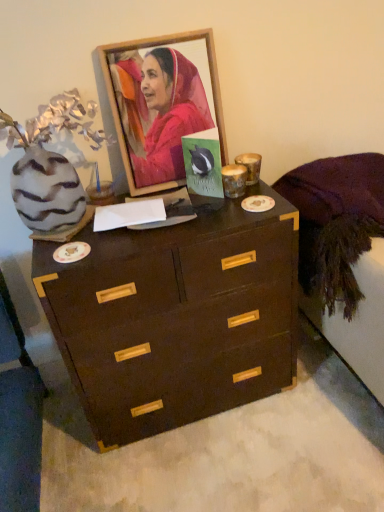
I want to click on purple fabric at right, so [x=343, y=255].

The height and width of the screenshot is (512, 384). Find the location of `green matte postcard at center`. green matte postcard at center is located at coordinates (203, 163).

Looking at this image, is wooden picture frame at upper center behind dark wood chest of drawers at center?

Yes, the depth of wooden picture frame at upper center is greater than that of dark wood chest of drawers at center.

From a real-world perspective, which object stands above the other?

From a 3D spatial view, wooden picture frame at upper center is above.

Is wooden picture frame at upper center positioned with its back to dark wood chest of drawers at center?

wooden picture frame at upper center is not turned away from dark wood chest of drawers at center.

Based on the photo, between wooden picture frame at upper center and dark wood chest of drawers at center, which one has larger size?

With larger size is dark wood chest of drawers at center.

Can you confirm if dark wood chest of drawers at center is positioned to the left of wooden picture frame at upper center?

Incorrect, dark wood chest of drawers at center is not on the left side of wooden picture frame at upper center.

Is wooden picture frame at upper center at the back of dark wood chest of drawers at center?

No.

From a real-world perspective, is dark wood chest of drawers at center physically located above or below wooden picture frame at upper center?

dark wood chest of drawers at center is below wooden picture frame at upper center.

You are a GUI agent. You are given a task and a screenshot of the screen. Output one action in this format:
    pyautogui.click(x=<x>, y=<y>)
    Task: Click on the picture frame on the left of the dark wood chest of drawers at center
    
    Given the screenshot: What is the action you would take?
    pyautogui.click(x=160, y=105)

Is purple fabric at right at the back of green matte postcard at center?

No, green matte postcard at center's orientation is not away from purple fabric at right.

Considering the positions of objects green matte postcard at center and purple fabric at right in the image provided, who is behind, green matte postcard at center or purple fabric at right?

green matte postcard at center is further from the camera.

Does point (212, 170) lie in front of point (371, 169)?

That is True.

You are a GUI agent. You are given a task and a screenshot of the screen. Output one action in this format:
    pyautogui.click(x=<x>, y=<y>)
    Task: Click on the bed frame below the green matte postcard at center (from the image's perspective)
    The image size is (384, 512).
    Given the screenshot: What is the action you would take?
    pyautogui.click(x=343, y=255)

In the scene shown: Is wooden picture frame at upper center completely or partially outside of green matte postcard at center?

Yes, wooden picture frame at upper center is located beyond the bounds of green matte postcard at center.

Is point (115, 70) positioned behind point (217, 131)?

No, (115, 70) is closer to viewer.

Which of these two, wooden picture frame at upper center or green matte postcard at center, is thinner?

With smaller width is wooden picture frame at upper center.

Does wooden picture frame at upper center have a lesser height compared to green matte postcard at center?

Incorrect, the height of wooden picture frame at upper center does not fall short of that of green matte postcard at center.

Image resolution: width=384 pixels, height=512 pixels. I want to click on postcard behind the purple fabric at right, so click(203, 163).

Does point (372, 343) appear closer or farther from the camera than point (202, 150)?

Point (372, 343).

What's the angular difference between purple fabric at right and green matte postcard at center's facing directions?

The angular difference between purple fabric at right and green matte postcard at center is 47.5 degrees.

Considering the relative sizes of purple fabric at right and green matte postcard at center in the image provided, is purple fabric at right smaller than green matte postcard at center?

No.

From a real-world perspective, who is located lower, green matte postcard at center or wooden picture frame at upper center?

green matte postcard at center is physically lower.

From the image's perspective, which is below, green matte postcard at center or wooden picture frame at upper center?

green matte postcard at center appears lower in the image.

Would you say dark wood chest of drawers at center contains green matte postcard at center?

No, green matte postcard at center is not a part of dark wood chest of drawers at center.

Considering the sizes of objects dark wood chest of drawers at center and green matte postcard at center in the image provided, who is smaller, dark wood chest of drawers at center or green matte postcard at center?

Smaller between the two is green matte postcard at center.

I want to click on chest of drawers that appears on the right of wooden picture frame at upper center, so click(x=176, y=317).

Locate an element on the screen. picture frame on the left of dark wood chest of drawers at center is located at coordinates (160, 105).

Consider the image. Estimate the real-world distances between objects in this image. Which object is further from purple fabric at right, dark wood chest of drawers at center or green matte postcard at center?

green matte postcard at center is positioned further to the anchor purple fabric at right.

Estimate the real-world distances between objects in this image. Which object is further from dark wood chest of drawers at center, green matte postcard at center or wooden picture frame at upper center?

The object further to dark wood chest of drawers at center is wooden picture frame at upper center.

From the image, which object appears to be nearer to green matte postcard at center, wooden picture frame at upper center or dark wood chest of drawers at center?

Based on the image, wooden picture frame at upper center appears to be nearer to green matte postcard at center.

When comparing their distances from dark wood chest of drawers at center, does green matte postcard at center or purple fabric at right seem further?

green matte postcard at center lies further to dark wood chest of drawers at center than the other object.

Which object lies further to the anchor point green matte postcard at center, purple fabric at right or wooden picture frame at upper center?

purple fabric at right is positioned further to the anchor green matte postcard at center.

Looking at the image, which one is located further to dark wood chest of drawers at center, purple fabric at right or wooden picture frame at upper center?

wooden picture frame at upper center.

Estimate the real-world distances between objects in this image. Which object is further from wooden picture frame at upper center, purple fabric at right or green matte postcard at center?

The object further to wooden picture frame at upper center is purple fabric at right.

When comparing their distances from wooden picture frame at upper center, does green matte postcard at center or purple fabric at right seem further?

purple fabric at right is positioned further to the anchor wooden picture frame at upper center.

The image size is (384, 512). Find the location of `the chest of drawers situated between wooden picture frame at upper center and purple fabric at right from left to right`. the chest of drawers situated between wooden picture frame at upper center and purple fabric at right from left to right is located at coordinates (176, 317).

Find the location of a particular element. The image size is (384, 512). postcard located between wooden picture frame at upper center and purple fabric at right in the left-right direction is located at coordinates (203, 163).

Find the location of `postcard between dark wood chest of drawers at center and purple fabric at right`. postcard between dark wood chest of drawers at center and purple fabric at right is located at coordinates (203, 163).

The image size is (384, 512). In order to click on postcard that lies between wooden picture frame at upper center and dark wood chest of drawers at center from top to bottom in this screenshot , I will do `click(203, 163)`.